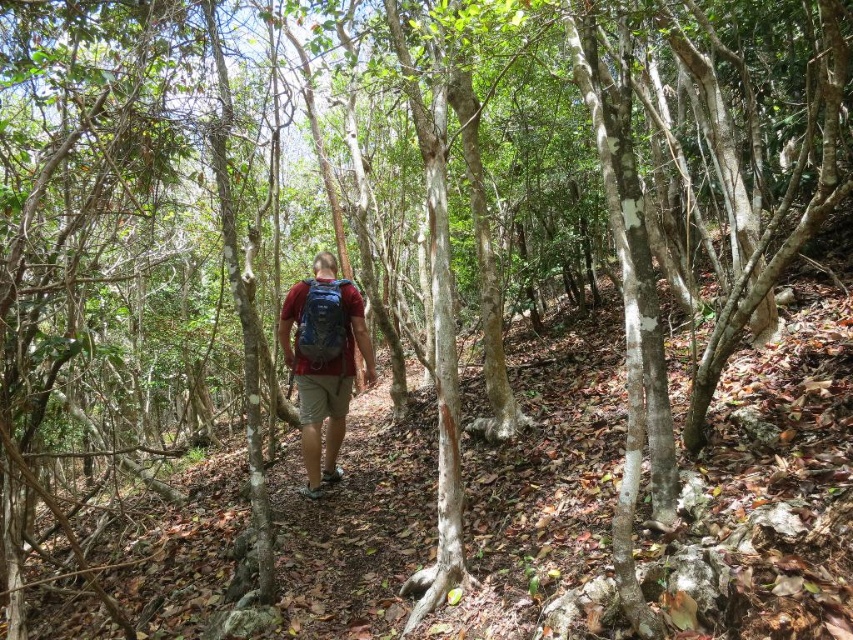
Question: Can you confirm if matte blue backpack at center is wider than blue fabric backpack at center?

Choices:
 (A) no
 (B) yes

Answer: (B)

Question: Does matte blue backpack at center appear on the right side of blue fabric backpack at center?

Choices:
 (A) no
 (B) yes

Answer: (A)

Question: Is matte blue backpack at center above blue fabric backpack at center?

Choices:
 (A) no
 (B) yes

Answer: (A)